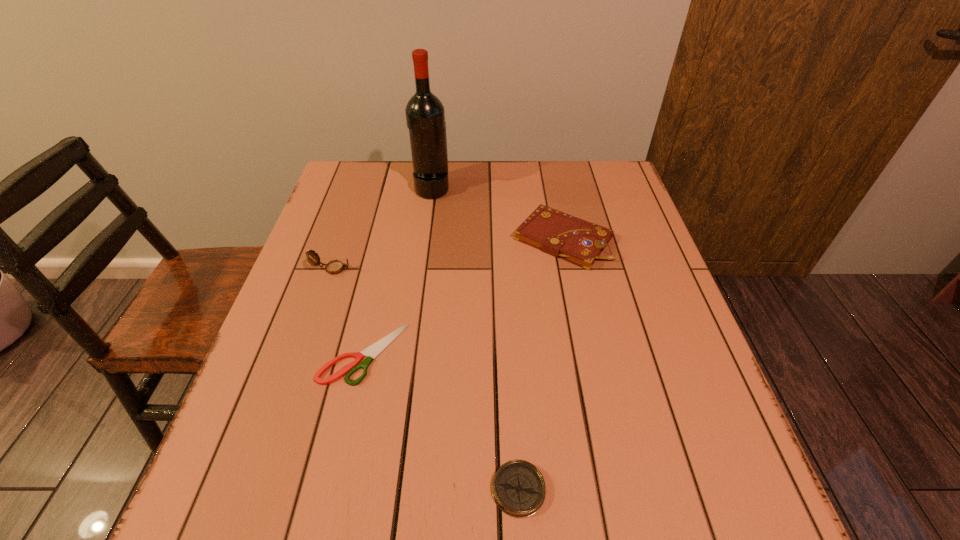
I want to click on free region at the near edge of the desktop, so click(627, 539).

Find the location of a particular element. The width and height of the screenshot is (960, 540). free space at the left edge of the desktop is located at coordinates (348, 299).

In the image, there is a desktop. Where is `vacant space at the right edge`? This screenshot has width=960, height=540. vacant space at the right edge is located at coordinates (608, 252).

The image size is (960, 540). Identify the location of free space at the far left corner. (329, 205).

Find the location of a particular element. vacant space at the near left corner of the desktop is located at coordinates (246, 517).

Where is `free region at the far right corner of the desktop`? This screenshot has width=960, height=540. free region at the far right corner of the desktop is located at coordinates (611, 176).

Find the location of `vacant space at the near right corner`. vacant space at the near right corner is located at coordinates (678, 480).

Locate an element on the screen. free point between the tallest object and the taller compass is located at coordinates (382, 228).

The height and width of the screenshot is (540, 960). I want to click on free spot between the fourth tallest object and the third shortest object, so click(540, 364).

This screenshot has height=540, width=960. I want to click on vacant area that lies between the second shortest object and the notebook, so click(540, 364).